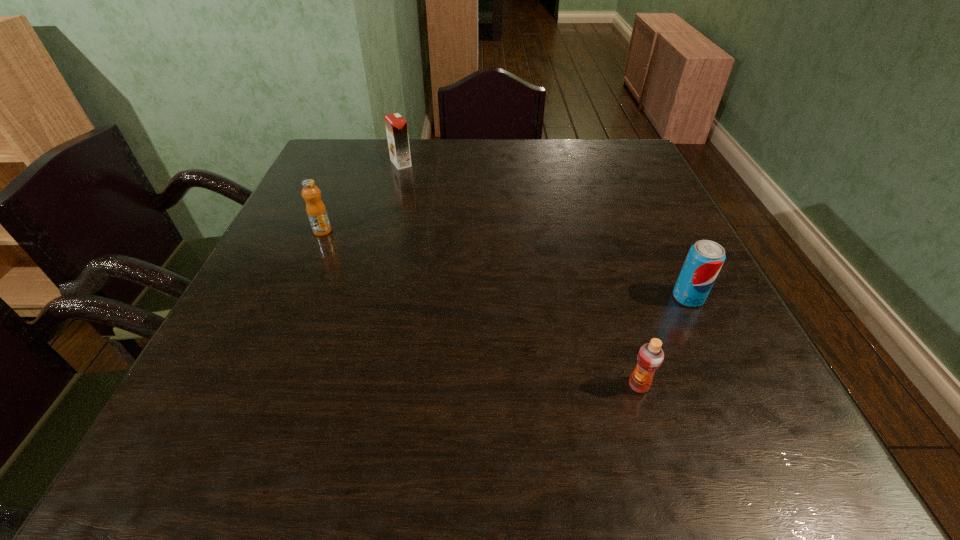
Find the location of a particular element. The image size is (960, 540). vacant area situated 0.190m on the left of the third farthest object is located at coordinates (577, 298).

Image resolution: width=960 pixels, height=540 pixels. Identify the location of vacant space located 0.200m on the left of the third object from left to right. (507, 386).

Where is `object located in the far edge section of the desktop`? object located in the far edge section of the desktop is located at coordinates (396, 126).

Where is `object that is at the left edge`? Image resolution: width=960 pixels, height=540 pixels. object that is at the left edge is located at coordinates (316, 211).

Find the location of a particular element. This screenshot has height=540, width=960. object located at the right edge is located at coordinates (705, 258).

You are a GUI agent. You are given a task and a screenshot of the screen. Output one action in this format:
    pyautogui.click(x=<x>, y=<y>)
    Task: Click on the vacant space at the far edge of the desktop
    This screenshot has width=960, height=540.
    Given the screenshot: What is the action you would take?
    pyautogui.click(x=432, y=155)

Identify the location of free region at the left edge of the desktop. (346, 218).

Where is `vacant region at the right edge of the desktop`? vacant region at the right edge of the desktop is located at coordinates (635, 179).

Identify the location of free spot at the far left corner of the desktop. This screenshot has height=540, width=960. (344, 154).

Locate an element on the screen. free space at the near left corner is located at coordinates (244, 452).